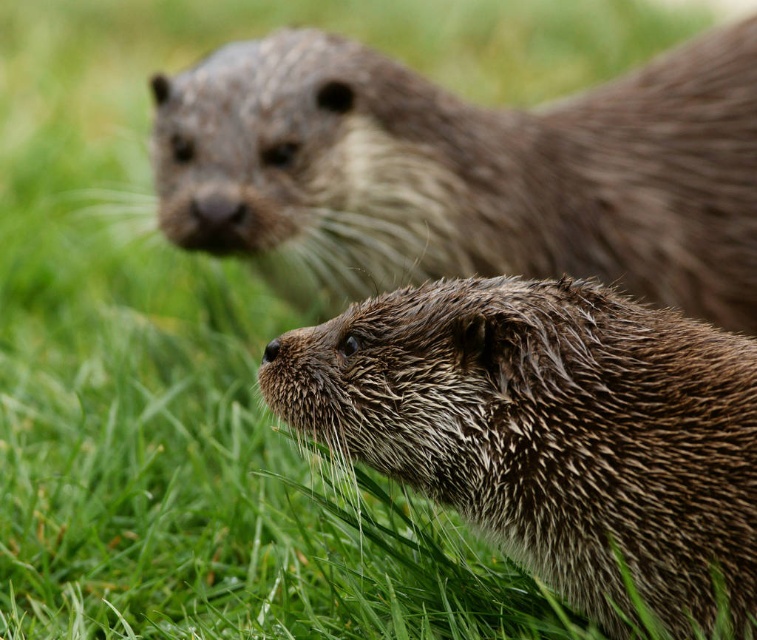
You are observing two otters in a grassy area. The brown fuzzy otter at upper center and the wet fur otter at center are both present. Which otter is positioned higher in the image?

The brown fuzzy otter at upper center is positioned higher in the image than the wet fur otter at center.

You are an animal researcher observing two otters in a grassy area. You notice a point marked at coordinates [463,173]. Which otter does this point indicate? The otter in the foreground or the one in the background?

The point marked at coordinates [463,173] indicates the brown fuzzy otter at upper center, which is the otter in the foreground since it is described as the head and upper body being visible with wet fur, alert eyes, and a wet nose reflecting light, while the background otter is partially visible and out of focus.

You are a wildlife photographer aiming to capture a closeup shot of both the brown fuzzy otter at upper center and the wet fur otter at center. Your camera can focus on subjects within a 1.5 meters range. Can you photograph both otters without moving your position?

The brown fuzzy otter at upper center is 1.57 meters away from the wet fur otter at center. Since the distance between them is slightly over your camera range of 1.5 meters, you cannot photograph both otters without moving your position.